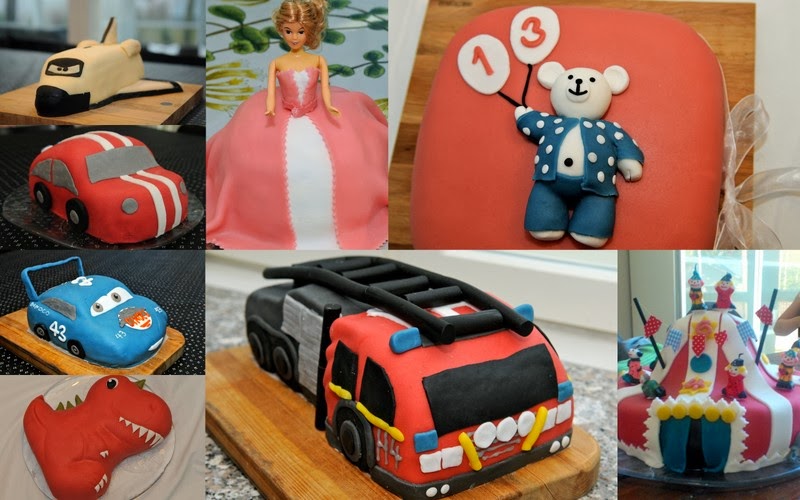
You are a GUI agent. You are given a task and a screenshot of the screen. Output one action in this format:
    pyautogui.click(x=<x>, y=<y>)
    Task: Click on the black spotted tablecloths
    The height and width of the screenshot is (500, 800).
    Given the screenshot: What is the action you would take?
    pyautogui.click(x=169, y=293), pyautogui.click(x=182, y=154), pyautogui.click(x=185, y=74)